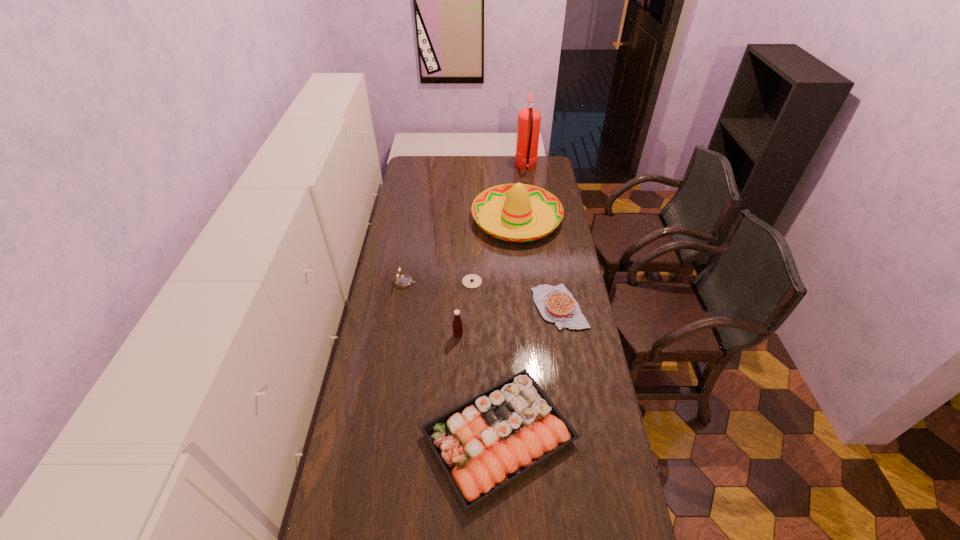
Locate an element on the screen. pie is located at coordinates (556, 304).

The image size is (960, 540). In order to click on vacant space situated 0.400m towards the nozzle of the fire extinguisher in this screenshot , I will do `click(446, 168)`.

Locate an element on the screen. This screenshot has width=960, height=540. vacant space located towards the nozzle of the fire extinguisher is located at coordinates (479, 168).

The width and height of the screenshot is (960, 540). In order to click on blank space located 0.100m towards the nozzle of the fire extinguisher in this screenshot , I will do point(498,168).

Identify the location of free point located 0.160m on the back of the sombrero. The image size is (960, 540). (513, 177).

Identify the location of vacant space located 0.060m on the back of the Tabasco sauce. This screenshot has height=540, width=960. (459, 319).

I want to click on vacant space located 0.140m with the dial facing the left compass, so click(x=447, y=283).

The width and height of the screenshot is (960, 540). Find the location of `vacant space positioned on the back of the third shortest object`. vacant space positioned on the back of the third shortest object is located at coordinates (496, 349).

Locate an element on the screen. vacant area situated 0.270m on the left of the right compass is located at coordinates (400, 281).

Locate an element on the screen. The image size is (960, 540). vacant region located 0.090m on the back of the pie is located at coordinates (553, 271).